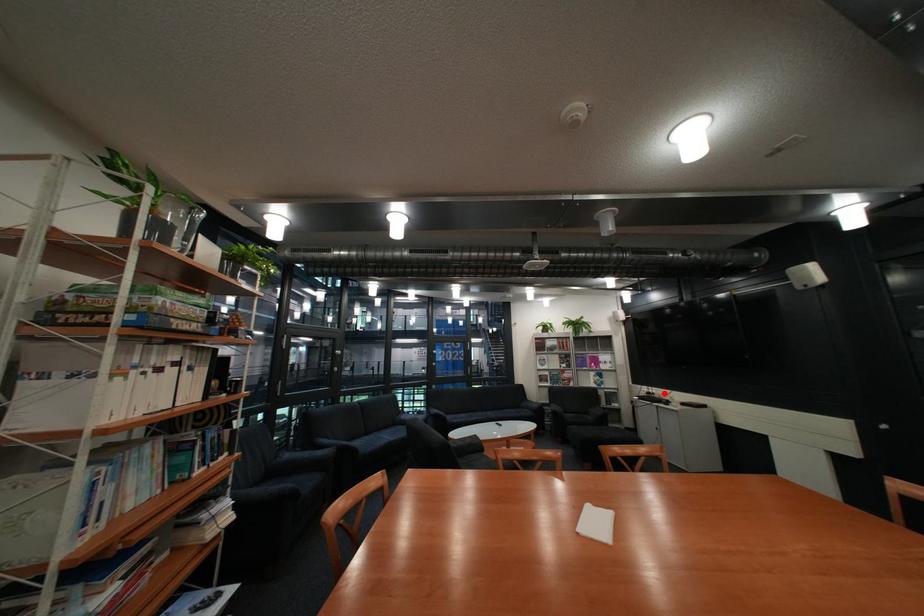
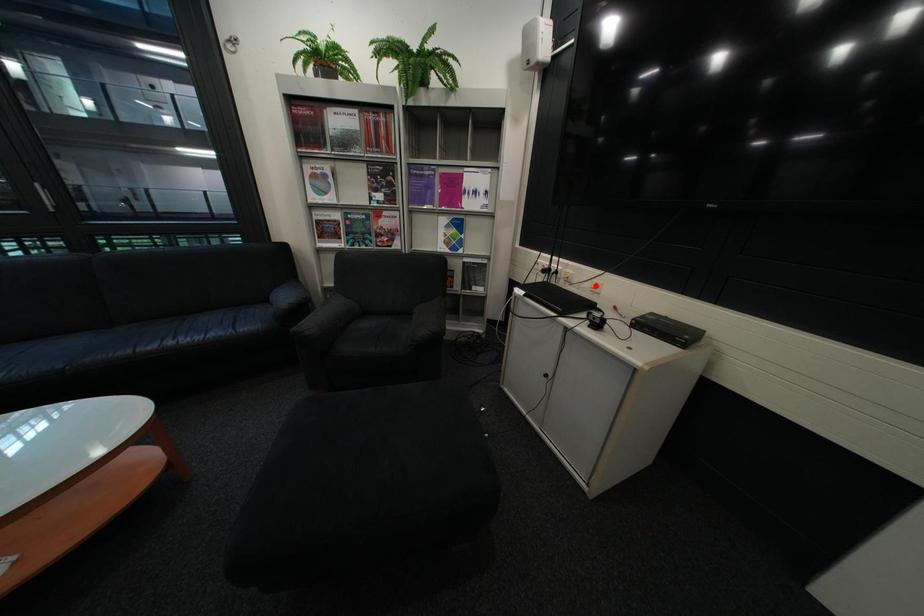
I am providing you with two images of the same scene from different viewpoints. A red point is marked on the first image and another point is marked on the second image. Do the highlighted points in image1 and image2 indicate the same real-world spot?

No